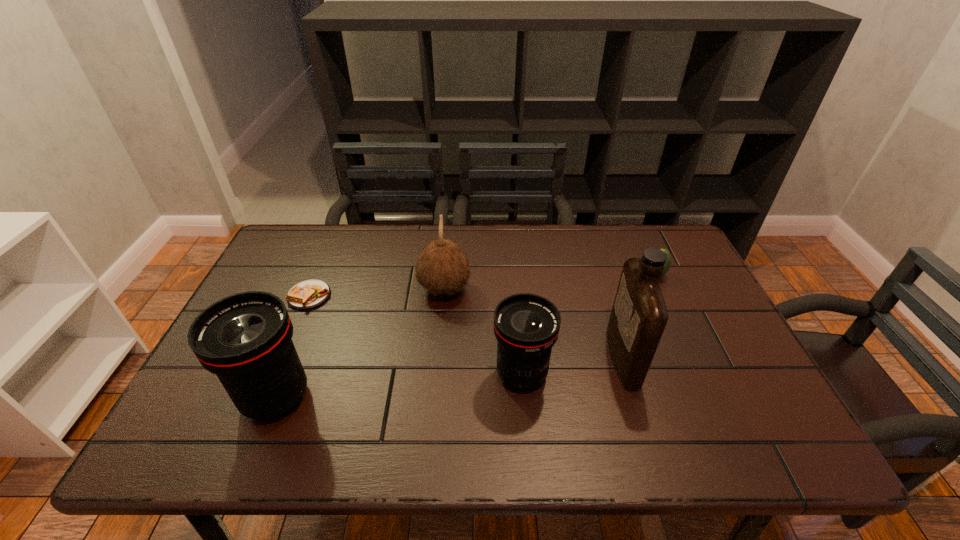
At what (x,y) coordinates should I click in order to perform the action: click on free space that satisfies the following two spatial constraints: 1. on the back side of the taller telephoto lens; 2. on the right side of the rightmost object. Please return your answer as a coordinate pair (x, y). Image resolution: width=960 pixels, height=540 pixels. Looking at the image, I should click on (325, 274).

Where is `free point that satisfies the following two spatial constraints: 1. on the label side of the tallest object; 2. on the front side of the taller telephoto lens`? The width and height of the screenshot is (960, 540). free point that satisfies the following two spatial constraints: 1. on the label side of the tallest object; 2. on the front side of the taller telephoto lens is located at coordinates (636, 397).

The image size is (960, 540). I want to click on vacant space that satisfies the following two spatial constraints: 1. on the surface of the coconut; 2. on the left side of the shorter telephoto lens, so click(437, 374).

Where is `blank space that satisfies the following two spatial constraints: 1. on the back side of the taller telephoto lens; 2. on the left side of the shorter telephoto lens`? This screenshot has width=960, height=540. blank space that satisfies the following two spatial constraints: 1. on the back side of the taller telephoto lens; 2. on the left side of the shorter telephoto lens is located at coordinates tap(285, 374).

Locate an element on the screen. Image resolution: width=960 pixels, height=540 pixels. vacant space that satisfies the following two spatial constraints: 1. on the front side of the taller telephoto lens; 2. on the right side of the sandwich is located at coordinates (266, 397).